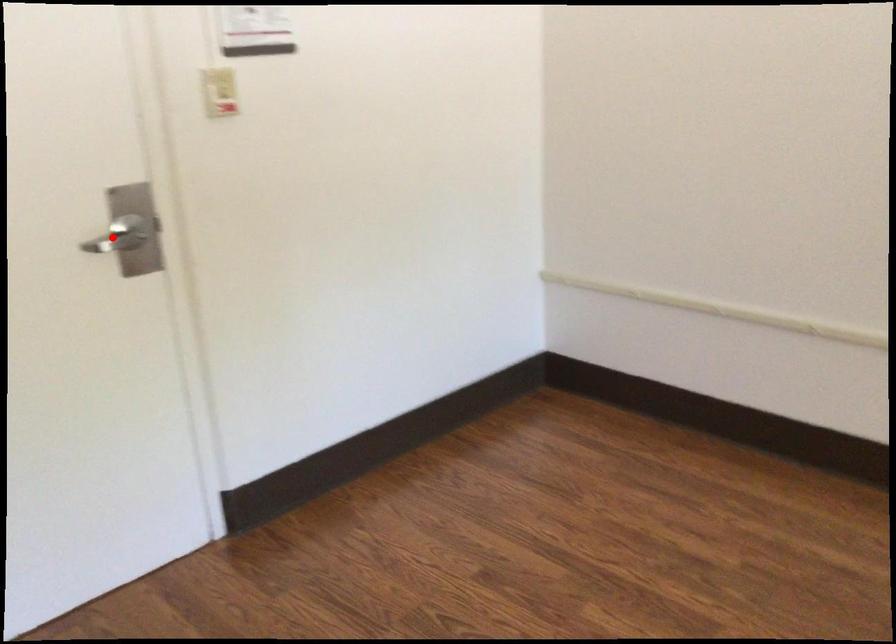
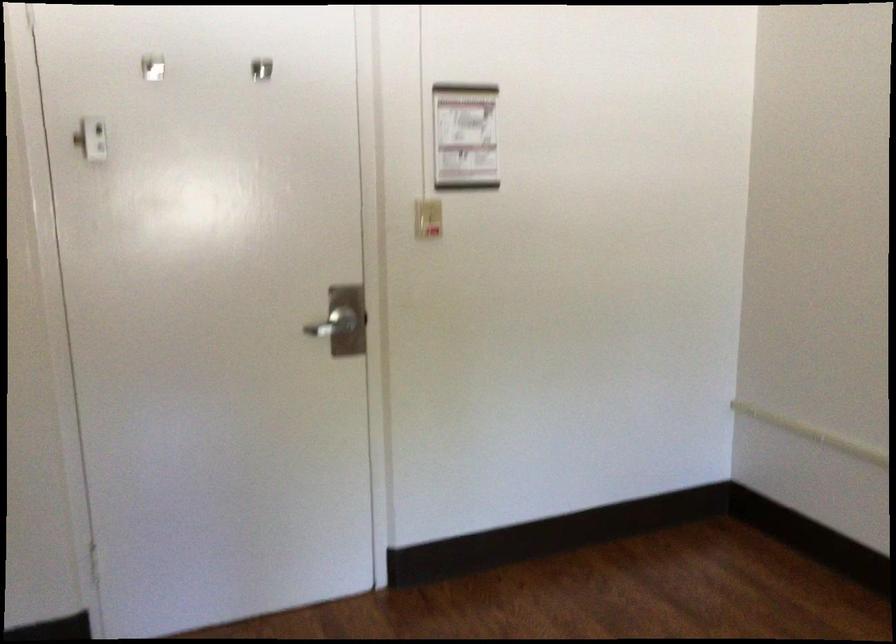
Find the pixel in the second image that matches the highlighted location in the first image.

(330, 323)